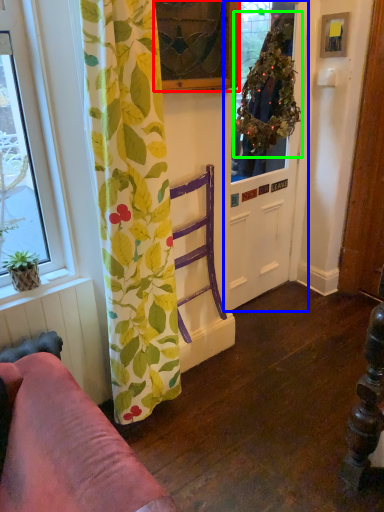
Question: Based on their relative distances, which object is nearer to window (highlighted by a red box)? Choose from door (highlighted by a blue box) and plant (highlighted by a green box).

Choices:
 (A) door
 (B) plant

Answer: (B)